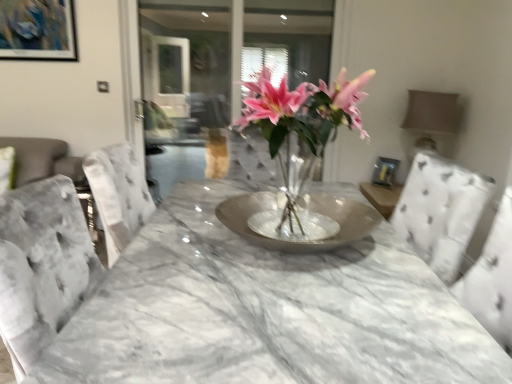
Describe the element at coordinates (38, 30) in the screenshot. I see `metallic silver picture frame at upper left` at that location.

The width and height of the screenshot is (512, 384). What do you see at coordinates (196, 49) in the screenshot? I see `transparent glass door at upper center` at bounding box center [196, 49].

You are a GUI agent. You are given a task and a screenshot of the screen. Output one action in this format:
    pyautogui.click(x=<x>, y=<y>)
    Task: Click on the pink glass vase at center
    This screenshot has width=512, height=384.
    Given the screenshot: What is the action you would take?
    pyautogui.click(x=298, y=132)

Is transparent glass door at upper center in front of or behind metallic silver picture frame at upper left in the image?

In the image, transparent glass door at upper center appears behind metallic silver picture frame at upper left.

Is transparent glass door at upper center located outside metallic silver picture frame at upper left?

That's correct, transparent glass door at upper center is outside of metallic silver picture frame at upper left.

Is transparent glass door at upper center aimed at metallic silver picture frame at upper left?

No, transparent glass door at upper center does not turn towards metallic silver picture frame at upper left.

From the picture: From the image's perspective, is pink glass vase at center on transparent glass door at upper center?

No.

Locate an element on the screen. The width and height of the screenshot is (512, 384). houseplant below the transparent glass door at upper center (from the image's perspective) is located at coordinates (298, 132).

Who is shorter, pink glass vase at center or transparent glass door at upper center?

pink glass vase at center is shorter.

Which is closer to the camera, (262, 235) or (196, 22)?

The point (262, 235) is closer to the camera.

Does point (32, 35) come in front of point (322, 65)?

Yes, point (32, 35) is in front of point (322, 65).

From a real-world perspective, is metallic silver picture frame at upper left on transparent glass door at upper center?

Correct, in the physical world, metallic silver picture frame at upper left is higher than transparent glass door at upper center.

Does metallic silver picture frame at upper left appear on the left side of transparent glass door at upper center?

Indeed, metallic silver picture frame at upper left is positioned on the left side of transparent glass door at upper center.

Considering the relative sizes of metallic silver picture frame at upper left and transparent glass door at upper center in the image provided, is metallic silver picture frame at upper left thinner than transparent glass door at upper center?

Yes, metallic silver picture frame at upper left is thinner than transparent glass door at upper center.

Which of these two, pink glass vase at center or metallic silver picture frame at upper left, is thinner?

With smaller width is metallic silver picture frame at upper left.

Does pink glass vase at center appear on the left side of metallic silver picture frame at upper left?

No.

Can you tell me how much pink glass vase at center and metallic silver picture frame at upper left differ in facing direction?

pink glass vase at center and metallic silver picture frame at upper left are facing 89.6 degrees away from each other.

Is metallic silver picture frame at upper left at the back of pink glass vase at center?

No, metallic silver picture frame at upper left is not at the back of pink glass vase at center.

Locate an element on the screen. houseplant that appears below the metallic silver picture frame at upper left (from a real-world perspective) is located at coordinates (298, 132).

Can you confirm if metallic silver picture frame at upper left is positioned to the right of pink glass vase at center?

In fact, metallic silver picture frame at upper left is to the left of pink glass vase at center.

Could pink glass vase at center be considered to be inside metallic silver picture frame at upper left?

No, pink glass vase at center is located outside of metallic silver picture frame at upper left.

Which object is further away from the camera, metallic silver picture frame at upper left or pink glass vase at center?

metallic silver picture frame at upper left is further from the camera.

Does point (245, 28) come behind point (283, 177)?

Yes, point (245, 28) is farther from viewer.

Is transparent glass door at upper center directly adjacent to pink glass vase at center?

transparent glass door at upper center and pink glass vase at center are not in contact.

Consider the image. Is transparent glass door at upper center located outside pink glass vase at center?

Yes, transparent glass door at upper center is outside of pink glass vase at center.

In terms of width, does transparent glass door at upper center look wider or thinner when compared to pink glass vase at center?

Clearly, transparent glass door at upper center has less width compared to pink glass vase at center.

The image size is (512, 384). Identify the location of glass door below the metallic silver picture frame at upper left (from the image's perspective). point(196,49).

The height and width of the screenshot is (384, 512). Find the location of `houseplant that appears in front of the transparent glass door at upper center`. houseplant that appears in front of the transparent glass door at upper center is located at coordinates (298, 132).

When comparing their distances from pink glass vase at center, does metallic silver picture frame at upper left or transparent glass door at upper center seem further?

transparent glass door at upper center is further to pink glass vase at center.

From the image, which object appears to be nearer to metallic silver picture frame at upper left, pink glass vase at center or transparent glass door at upper center?

transparent glass door at upper center.

Based on their spatial positions, is transparent glass door at upper center or pink glass vase at center further from metallic silver picture frame at upper left?

pink glass vase at center.

Considering their positions, is pink glass vase at center positioned further to transparent glass door at upper center than metallic silver picture frame at upper left?

pink glass vase at center is further to transparent glass door at upper center.

Looking at the image, which one is located closer to pink glass vase at center, transparent glass door at upper center or metallic silver picture frame at upper left?

metallic silver picture frame at upper left lies closer to pink glass vase at center than the other object.

Estimate the real-world distances between objects in this image. Which object is further from transparent glass door at upper center, metallic silver picture frame at upper left or pink glass vase at center?

Among the two, pink glass vase at center is located further to transparent glass door at upper center.

This screenshot has width=512, height=384. What are the coordinates of `picture frame between pink glass vase at center and transparent glass door at upper center along the z-axis` in the screenshot? It's located at (38, 30).